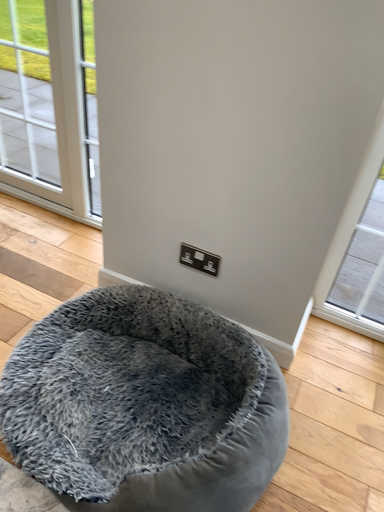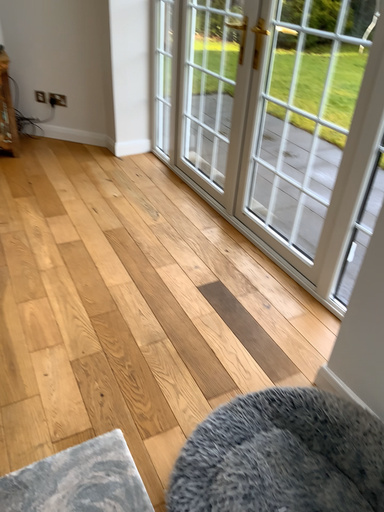
Question: Which way did the camera rotate in the video?

Choices:
 (A) rotated left
 (B) rotated right

Answer: (A)